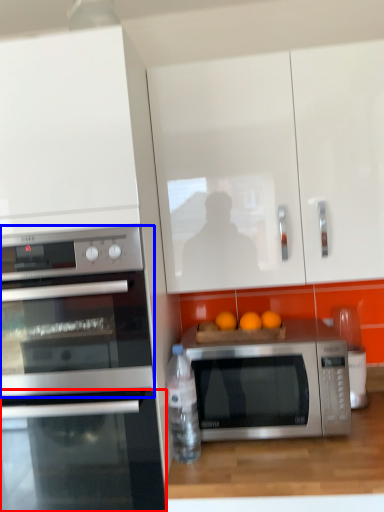
Question: Which object is closer to the camera taking this photo, oven (highlighted by a red box) or microwave oven (highlighted by a blue box)?

Choices:
 (A) oven
 (B) microwave oven

Answer: (B)